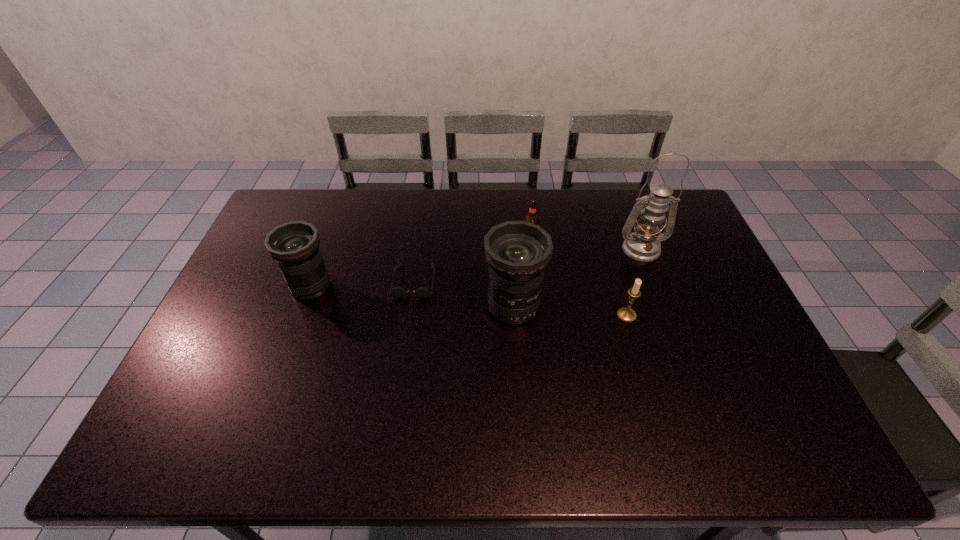
The width and height of the screenshot is (960, 540). I want to click on the shorter telephoto lens, so click(x=294, y=246).

The height and width of the screenshot is (540, 960). In order to click on the left telephoto lens in this screenshot , I will do `click(294, 246)`.

What are the coordinates of `the right telephoto lens` in the screenshot? It's located at (517, 252).

Locate an element on the screen. The width and height of the screenshot is (960, 540). the second tallest object is located at coordinates (517, 252).

Locate an element on the screen. The height and width of the screenshot is (540, 960). oil lamp is located at coordinates (643, 245).

This screenshot has height=540, width=960. I want to click on the rightmost object, so click(643, 245).

This screenshot has width=960, height=540. I want to click on candle holder, so click(x=626, y=314).

Locate an element on the screen. Image resolution: width=960 pixels, height=540 pixels. sunglasses is located at coordinates (422, 292).

Identify the location of the second object from left to right. (422, 292).

Where is `root beer`? The height and width of the screenshot is (540, 960). root beer is located at coordinates (532, 218).